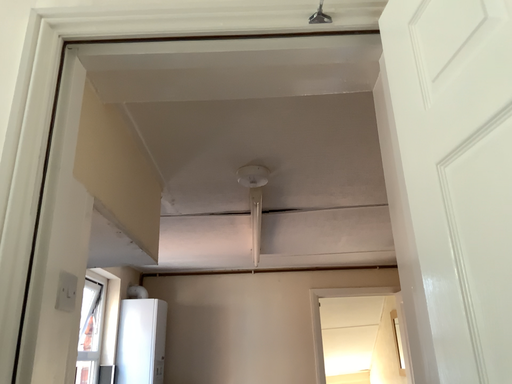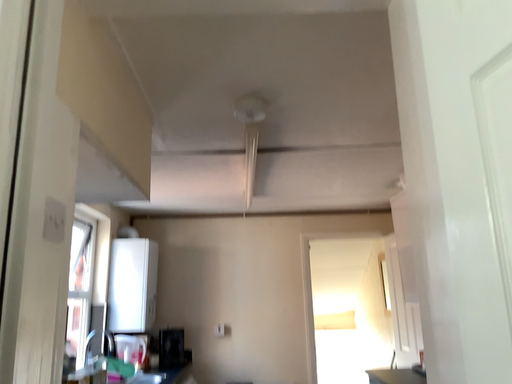
Question: Which way did the camera rotate in the video?

Choices:
 (A) rotated upward
 (B) rotated downward

Answer: (B)